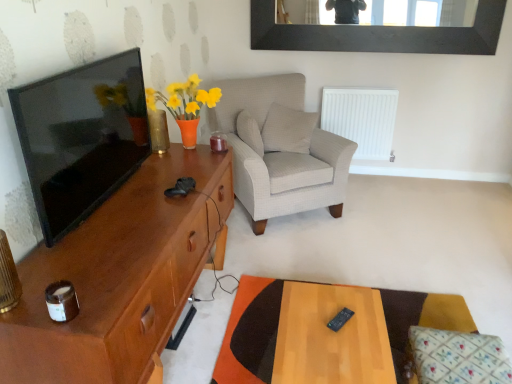
The width and height of the screenshot is (512, 384). What are the coordinates of `vacant space underneath matte black tv at left (from a real-world perspective)` in the screenshot? It's located at (x=116, y=190).